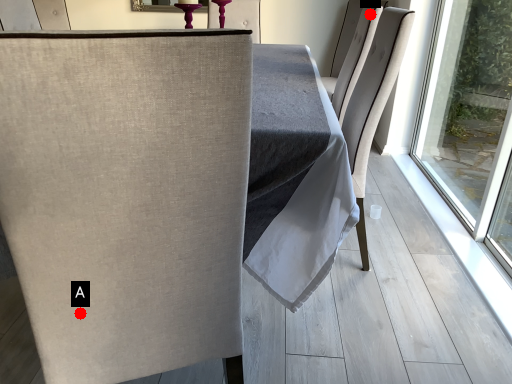
Question: Two points are circled on the image, labeled by A and B beside each circle. Which of the following is the farthest from the observer?

Choices:
 (A) A is further
 (B) B is further

Answer: (B)